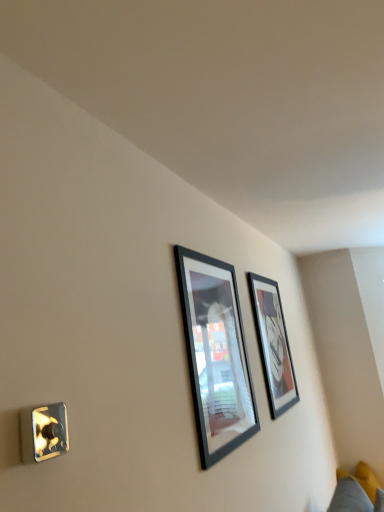
Question: Which direction should I rotate to face matte black picture frame at upper center, which appears as the 2th picture frame when viewed from the front, — up or down?

Choices:
 (A) down
 (B) up

Answer: (A)

Question: Is matte black picture frame at upper center, positioned as the 1th picture frame in right-to-left order, wider than black glossy picture frame at center, the first picture frame from the front?

Choices:
 (A) no
 (B) yes

Answer: (B)

Question: Considering the relative sizes of matte black picture frame at upper center, which is the 1th picture frame in back-to-front order, and black glossy picture frame at center, placed as the first picture frame when sorted from left to right, in the image provided, is matte black picture frame at upper center, which is the 1th picture frame in back-to-front order, taller than black glossy picture frame at center, placed as the first picture frame when sorted from left to right,?

Choices:
 (A) yes
 (B) no

Answer: (A)

Question: Considering the relative sizes of matte black picture frame at upper center, which is the 1th picture frame in back-to-front order, and black glossy picture frame at center, the first picture frame from the front, in the image provided, is matte black picture frame at upper center, which is the 1th picture frame in back-to-front order, thinner than black glossy picture frame at center, the first picture frame from the front,?

Choices:
 (A) yes
 (B) no

Answer: (B)

Question: Can you see matte black picture frame at upper center, which is the 1th picture frame in back-to-front order, touching black glossy picture frame at center, placed as the first picture frame when sorted from left to right?

Choices:
 (A) no
 (B) yes

Answer: (A)

Question: Is black glossy picture frame at center, placed as the first picture frame when sorted from left to right, surrounded by matte black picture frame at upper center, the 2th picture frame from the left?

Choices:
 (A) no
 (B) yes

Answer: (A)

Question: Does matte black picture frame at upper center, positioned as the 1th picture frame in right-to-left order, have a larger size compared to black glossy picture frame at center, acting as the second picture frame starting from the right?

Choices:
 (A) yes
 (B) no

Answer: (B)

Question: Is yellow fabric couch at lower right in contact with black glossy picture frame at center, placed as the first picture frame when sorted from left to right?

Choices:
 (A) no
 (B) yes

Answer: (A)

Question: From a real-world perspective, is yellow fabric couch at lower right on black glossy picture frame at center, the first picture frame from the front?

Choices:
 (A) no
 (B) yes

Answer: (A)

Question: From the image's perspective, does yellow fabric couch at lower right appear lower than black glossy picture frame at center, the second picture frame from the back?

Choices:
 (A) yes
 (B) no

Answer: (A)

Question: Is yellow fabric couch at lower right surrounding black glossy picture frame at center, the second picture frame from the back?

Choices:
 (A) no
 (B) yes

Answer: (A)

Question: Is yellow fabric couch at lower right far from black glossy picture frame at center, the second picture frame from the back?

Choices:
 (A) yes
 (B) no

Answer: (A)

Question: Could you tell me if yellow fabric couch at lower right is turned towards black glossy picture frame at center, the first picture frame from the front?

Choices:
 (A) no
 (B) yes

Answer: (A)

Question: Would you say yellow fabric couch at lower right contains matte black picture frame at upper center, which appears as the 2th picture frame when viewed from the front?

Choices:
 (A) no
 (B) yes

Answer: (A)